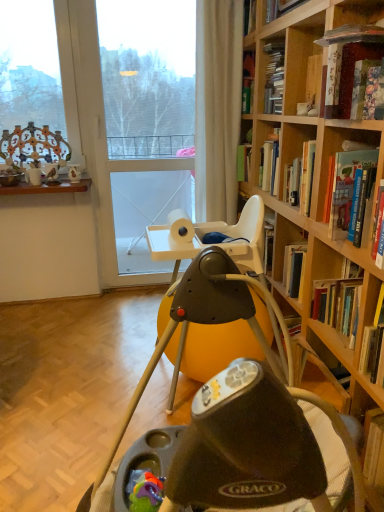
What do you see at coordinates (29, 67) in the screenshot? This screenshot has width=384, height=512. I see `matte glass window at upper left` at bounding box center [29, 67].

Describe the element at coordinates (144, 490) in the screenshot. The height and width of the screenshot is (512, 384). I see `rubberized plastic teether at lower center` at that location.

In order to face transparent glass door at center, should I rotate leftwards or rightwards?

Rotate left and turn 5.790 degrees.

I want to click on matte white cup at upper left, so click(34, 176).

From the image's perspective, is rubberized plastic teether at lower center located beneath matte black swing at center?

Yes, from the image's perspective, rubberized plastic teether at lower center is beneath matte black swing at center.

From a real-world perspective, which is physically below, rubberized plastic teether at lower center or matte black swing at center?

In real-world perspective, rubberized plastic teether at lower center is lower.

Is rubberized plastic teether at lower center shorter than matte black swing at center?

Yes.

Is rubberized plastic teether at lower center far away from matte black swing at center?

That's not correct — rubberized plastic teether at lower center is a little close to matte black swing at center.

In the scene shown: Is matte black swing at center placed right next to hardcover book at upper right, placed as the second book when sorted from bottom to top?

No, matte black swing at center is not with hardcover book at upper right, placed as the second book when sorted from bottom to top.

Which object is further away from the camera, matte black swing at center or hardcover book at upper right, placed as the second book when sorted from bottom to top?

hardcover book at upper right, placed as the second book when sorted from bottom to top, is behind.

Is matte black swing at center oriented towards hardcover book at upper right, placed as the second book when sorted from bottom to top?

No, matte black swing at center is not aimed at hardcover book at upper right, placed as the second book when sorted from bottom to top.

Which point is more forward, (332, 458) or (336, 68)?

Positioned in front is point (332, 458).

Considering the positions of objects matte white cup at upper left and hardcover book at upper right, placed as the 3th book when sorted from bottom to top, in the image provided, who is more to the left, matte white cup at upper left or hardcover book at upper right, placed as the 3th book when sorted from bottom to top,?

Positioned to the left is matte white cup at upper left.

At what (x,y) coordinates should I click in order to perform the action: click on coffee cup below the hardcover book at upper right, placed as the 3th book when sorted from bottom to top (from the image's perspective). Please return your answer as a coordinate pair (x, y). The height and width of the screenshot is (512, 384). Looking at the image, I should click on (34, 176).

Which object is closer to the camera, matte white cup at upper left or hardcover book at upper right, placed as the 3th book when sorted from bottom to top?

hardcover book at upper right, placed as the 3th book when sorted from bottom to top.

How different are the orientations of matte white cup at upper left and hardcover book at upper right, placed as the 3th book when sorted from bottom to top, in degrees?

89.6 degrees separate the facing orientations of matte white cup at upper left and hardcover book at upper right, placed as the 3th book when sorted from bottom to top.

Is hardcover book at upper right, placed as the 3th book when sorted from bottom to top, far from hardcover book at upper right, which is the 3th book in top-to-bottom order?

No, there isn't a large distance between hardcover book at upper right, placed as the 3th book when sorted from bottom to top, and hardcover book at upper right, which is the 3th book in top-to-bottom order.

From the picture: Is hardcover book at upper right, which is the 3th book in top-to-bottom order, at the back of hardcover book at upper right, the 1th book from the top?

hardcover book at upper right, the 1th book from the top, is not turned away from hardcover book at upper right, which is the 3th book in top-to-bottom order.

Is hardcover book at upper right, the 1th book from the top, taller or shorter than hardcover book at upper right, which is the 3th book in top-to-bottom order?

Considering their sizes, hardcover book at upper right, the 1th book from the top, has less height than hardcover book at upper right, which is the 3th book in top-to-bottom order.

Which is more to the right, hardcover book at upper right, placed as the 3th book when sorted from bottom to top, or hardcover book at upper right, the 1th book in the bottom-to-top sequence?

hardcover book at upper right, the 1th book in the bottom-to-top sequence, is more to the right.

Considering the sizes of objects hardcover book at upper right, the 1th book in the bottom-to-top sequence, and matte black swing at center in the image provided, who is thinner, hardcover book at upper right, the 1th book in the bottom-to-top sequence, or matte black swing at center?

hardcover book at upper right, the 1th book in the bottom-to-top sequence.

In the scene shown: How different are the orientations of hardcover book at upper right, which is the 3th book in top-to-bottom order, and matte black swing at center in degrees?

The angular difference between hardcover book at upper right, which is the 3th book in top-to-bottom order, and matte black swing at center is 8.37 degrees.

Is hardcover book at upper right, the 1th book in the bottom-to-top sequence, outside of matte black swing at center?

Yes, hardcover book at upper right, the 1th book in the bottom-to-top sequence, is outside of matte black swing at center.

Considering the sizes of objects hardcover book at upper right, which is the 3th book in top-to-bottom order, and matte black swing at center in the image provided, who is smaller, hardcover book at upper right, which is the 3th book in top-to-bottom order, or matte black swing at center?

Answer: Smaller between the two is hardcover book at upper right, which is the 3th book in top-to-bottom order.

Is hardcover book at upper right, the second book in the top-to-bottom sequence, wider or thinner than transparent glass door at center?

In the image, hardcover book at upper right, the second book in the top-to-bottom sequence, appears to be wider than transparent glass door at center.

Does hardcover book at upper right, the second book in the top-to-bottom sequence, lie in front of transparent glass door at center?

Yes.

Measure the distance from hardcover book at upper right, the second book in the top-to-bottom sequence, to transparent glass door at center.

5.54 feet.

Is point (357, 53) farther from camera compared to point (114, 77)?

No, it is not.

Is rubberized plastic teether at lower center thinner than beige fabric curtain at upper center?

Correct, the width of rubberized plastic teether at lower center is less than that of beige fabric curtain at upper center.

Is rubberized plastic teether at lower center bigger or smaller than beige fabric curtain at upper center?

In the image, rubberized plastic teether at lower center appears to be smaller than beige fabric curtain at upper center.

Locate an element on the screen. Image resolution: width=384 pixels, height=512 pixels. curtain behind the rubberized plastic teether at lower center is located at coordinates (217, 106).

Is beige fabric curtain at upper center a part of rubberized plastic teether at lower center?

That's incorrect, beige fabric curtain at upper center is not inside rubberized plastic teether at lower center.

Locate an element on the screen. The image size is (384, 512). toy below the matte black swing at center (from a real-world perspective) is located at coordinates (144, 490).

Where is `the 2nd book counting from the right side of the matte black swing at center`? This screenshot has width=384, height=512. the 2nd book counting from the right side of the matte black swing at center is located at coordinates (345, 75).

Looking at the image, which one is located closer to matte glass window at upper left, hardcover book at upper right, which is the 3th book in top-to-bottom order, or hardcover book at upper right, placed as the second book when sorted from bottom to top?

hardcover book at upper right, placed as the second book when sorted from bottom to top.

Estimate the real-world distances between objects in this image. Which object is further from beige fabric curtain at upper center, hardcover book at upper right, the 1th book from the top, or matte black swing at center?

matte black swing at center is positioned further to the anchor beige fabric curtain at upper center.

Which object lies further to the anchor point matte glass window at upper left, hardcover book at upper right, the 1th book in the bottom-to-top sequence, or transparent glass door at center?

hardcover book at upper right, the 1th book in the bottom-to-top sequence.

Considering their positions, is hardcover book at upper right, the second book in the top-to-bottom sequence, positioned closer to beige fabric curtain at upper center than matte glass window at upper left?

matte glass window at upper left is closer to beige fabric curtain at upper center.

Which object lies nearer to the anchor point hardcover book at upper right, which is the 3th book in top-to-bottom order, matte white cup at upper left or matte glass window at upper left?

Among the two, matte white cup at upper left is located nearer to hardcover book at upper right, which is the 3th book in top-to-bottom order.

Considering their positions, is rubberized plastic teether at lower center positioned further to hardcover book at upper right, the 1th book from the top, than matte black swing at center?

Based on the image, rubberized plastic teether at lower center appears to be further to hardcover book at upper right, the 1th book from the top.

From the image, which object appears to be farther from matte white cup at upper left, hardcover book at upper right, placed as the 3th book when sorted from bottom to top, or rubberized plastic teether at lower center?

Based on the image, rubberized plastic teether at lower center appears to be further to matte white cup at upper left.

Estimate the real-world distances between objects in this image. Which object is closer to matte black swing at center, hardcover book at upper right, which is the 3th book in top-to-bottom order, or beige fabric curtain at upper center?

hardcover book at upper right, which is the 3th book in top-to-bottom order, lies closer to matte black swing at center than the other object.

Where is `glass door positioned between hardcover book at upper right, placed as the 3th book when sorted from bottom to top, and matte white cup at upper left from near to far`? This screenshot has width=384, height=512. glass door positioned between hardcover book at upper right, placed as the 3th book when sorted from bottom to top, and matte white cup at upper left from near to far is located at coordinates (148, 77).

What are the coordinates of `glass door between matte glass window at upper left and hardcover book at upper right, the 1th book in the bottom-to-top sequence, from left to right` in the screenshot? It's located at (148, 77).

The image size is (384, 512). In order to click on curtain that lies between matte glass window at upper left and rubberized plastic teether at lower center from top to bottom in this screenshot , I will do click(x=217, y=106).

I want to click on coffee cup located between matte glass window at upper left and hardcover book at upper right, the 1th book from the top, in the left-right direction, so click(x=34, y=176).